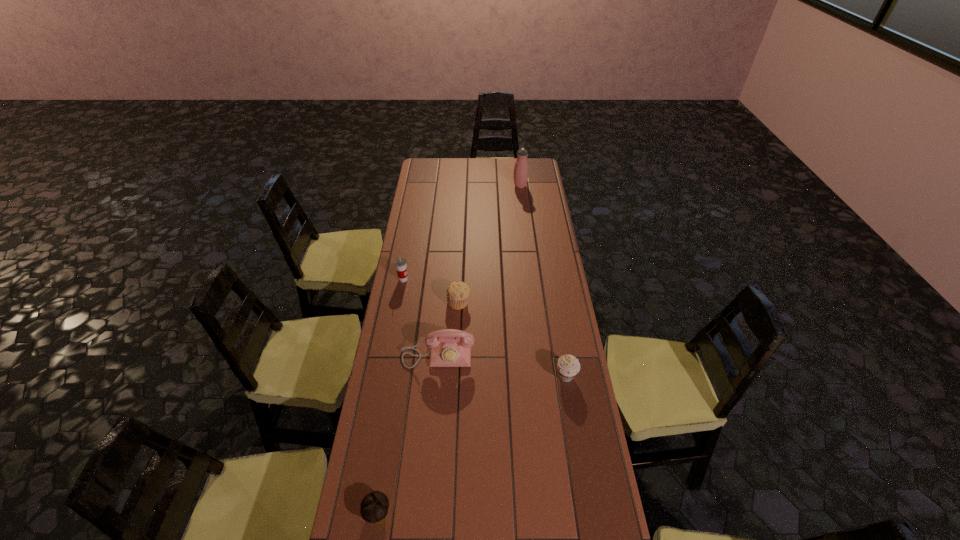
I want to click on free location located on the left of the second object from right to left, so click(499, 186).

At what (x,y) coordinates should I click in order to perform the action: click on vacant space situated on the side of the cup with the logo. Please return your answer as a coordinate pair (x, y). The height and width of the screenshot is (540, 960). Looking at the image, I should click on (425, 279).

Locate an element on the screen. This screenshot has height=540, width=960. blank area located on the dial of the telephone is located at coordinates (431, 440).

The image size is (960, 540). I want to click on vacant area located on the back of the rightmost object, so click(553, 298).

Where is `free space located on the right of the farthest muffin`? The width and height of the screenshot is (960, 540). free space located on the right of the farthest muffin is located at coordinates click(518, 302).

Locate an element on the screen. The height and width of the screenshot is (540, 960). vacant space located 0.210m on the back of the nearest object is located at coordinates (390, 431).

Locate an element on the screen. Image resolution: width=960 pixels, height=540 pixels. cup that is positioned at the left edge is located at coordinates (400, 263).

Image resolution: width=960 pixels, height=540 pixels. Find the location of `telephone that is at the left edge`. telephone that is at the left edge is located at coordinates (449, 347).

Find the location of a particular element. This screenshot has height=540, width=960. muffin present at the left edge is located at coordinates (374, 507).

Where is `thermos bottle located at the right edge`? thermos bottle located at the right edge is located at coordinates (521, 169).